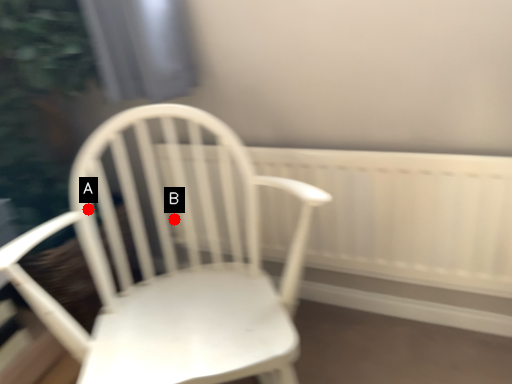
Question: Two points are circled on the image, labeled by A and B beside each circle. Which point is closer to the camera?

Choices:
 (A) A is closer
 (B) B is closer

Answer: (A)